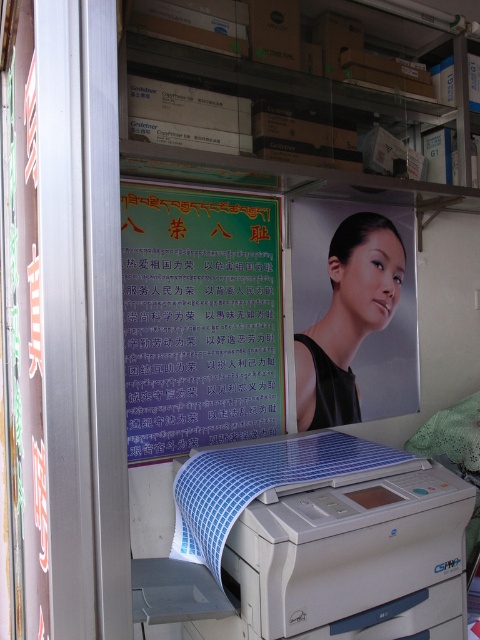
Looking at this image, you are an office assistant who needs to place a new label on either the white plastic printer at lower center or the matte black portrait at center. The label you have is 15 cm in length. Which object can the label fit on without overlapping the edges?

The white plastic printer at lower center has a larger size compared to matte black portrait at center, so the label can fit on the white plastic printer at lower center without overlapping the edges.

You are organizing the office and need to place a new label on the wall next to the white plastic printer at lower center. According to the scene, where should you place the label so it is to the right of the green paper poster at center?

The green paper poster at center is to the left of white plastic printer at lower center, so placing the label to the right of the green paper poster at center would position it directly next to the white plastic printer at lower center.